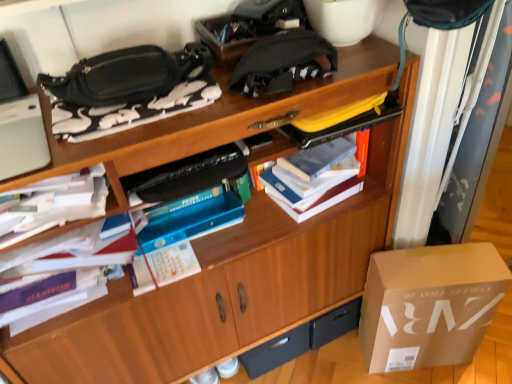
Question: Considering their positions, is white fabric curtain at upper right located in front of or behind matte cardboard box at lower right?

Choices:
 (A) behind
 (B) front

Answer: (B)

Question: Based on their sizes in the image, would you say white fabric curtain at upper right is bigger or smaller than matte cardboard box at lower right?

Choices:
 (A) big
 (B) small

Answer: (A)

Question: Which of these objects is positioned farthest from the black matte drawer at lower center?

Choices:
 (A) black matte bag at upper left, positioned as the third book in left-to-right order
 (B) white fabric curtain at upper right
 (C) hardcover book at center, placed as the first book when sorted from right to left
 (D) white paper at left, acting as the third book starting from the right
 (E) black fabric pouch at upper center

Answer: (A)

Question: Which object is the closest to the black matte bag at upper left, positioned as the third book in left-to-right order?

Choices:
 (A) hardcover book at center, placed as the first book when sorted from right to left
 (B) white fabric curtain at upper right
 (C) white paper at left, acting as the third book starting from the right
 (D) black fabric pouch at upper center
 (E) matte cardboard box at lower right

Answer: (C)